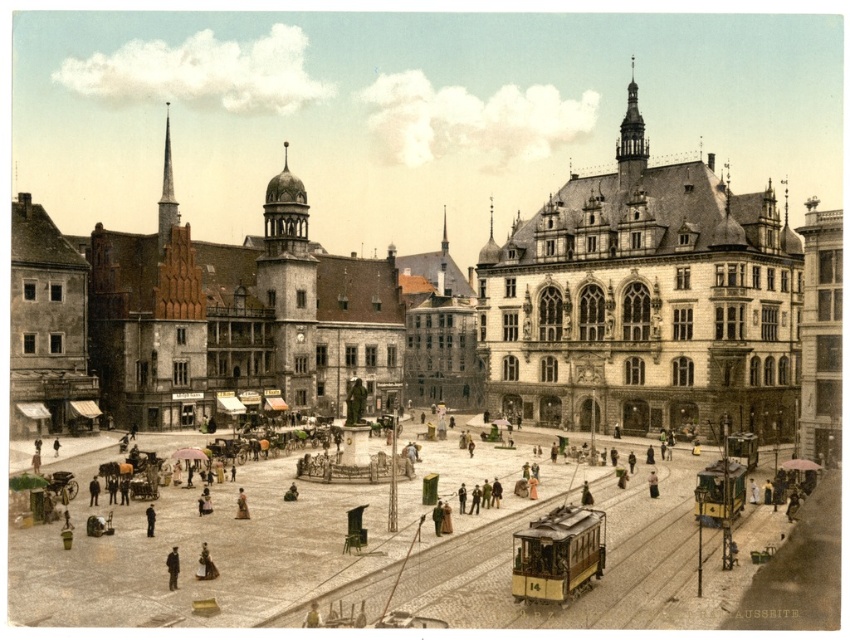
Question: Which object is closer to the camera taking this photo?

Choices:
 (A) stone building at center
 (B) smooth beige hat at lower center
 (C) dark brown leather coat at lower left
 (D) brown leather jacket at center

Answer: (B)

Question: Which is farther from the light brown leather jacket at center?

Choices:
 (A) stone building at center
 (B) brown leather jacket at center
 (C) dark gray suit at lower left

Answer: (A)

Question: Can you confirm if brown leather jacket at center is positioned to the right of light brown leather jacket at center?

Choices:
 (A) no
 (B) yes

Answer: (A)

Question: Which of these objects is positioned farthest from the light brown leather jacket at center?

Choices:
 (A) stone building at center
 (B) dark brown leather coat at lower left
 (C) dark gray suit at lower left

Answer: (A)

Question: Is dark brown leather coat at lower left behind light brown leather jacket at center?

Choices:
 (A) yes
 (B) no

Answer: (B)

Question: Does stone building at center have a smaller size compared to dark gray suit at lower left?

Choices:
 (A) yes
 (B) no

Answer: (B)